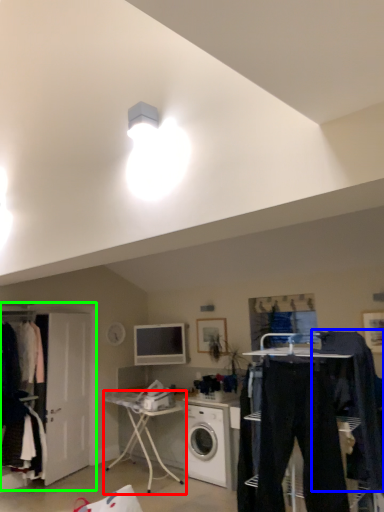
Question: Estimate the real-world distances between objects in this image. Which object is closer to desk (highlighted by a red box), clothing (highlighted by a blue box) or closet (highlighted by a green box)?

Choices:
 (A) clothing
 (B) closet

Answer: (B)